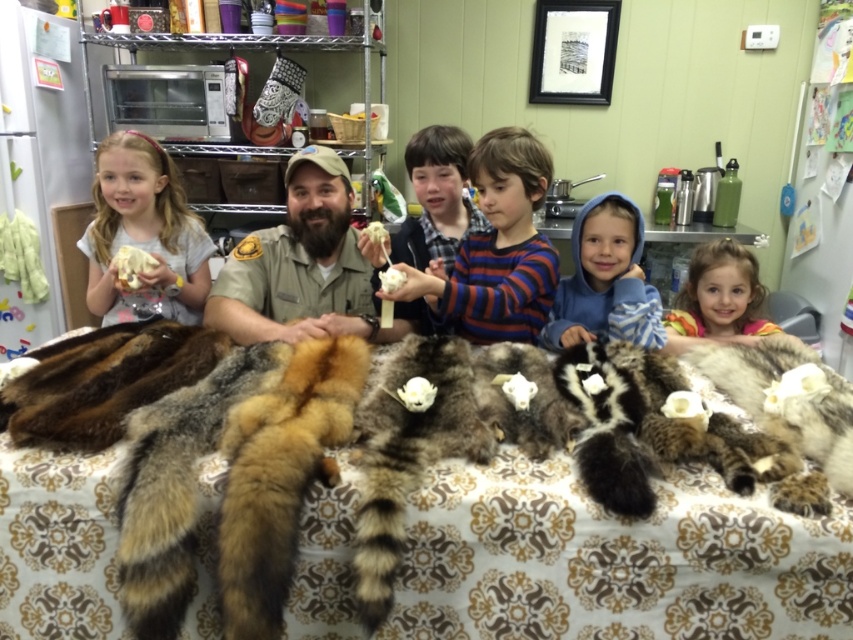
You are standing at the center of the scene and want to locate the blonde hair at lower right. Based on the coordinates provided, in which direction should you turn to face it?

The blonde hair at lower right is located at coordinates point (x=718, y=298), which means it is positioned to the lower right of the scene. Since you are at the center, you should turn to your lower right direction to face it.

You are a photographer trying to capture a group photo of the brown uniform at center and the white fluffy cotton at center. If you want to ensure both are fully visible in the frame, which object requires more space horizontally?

The brown uniform at center requires more horizontal space because its width is larger than the white fluffy cotton at center.

You are a photographer trying to capture a group photo of the brown uniform at center and the white fluffy cotton at center. Which object should you focus on first if you want to ensure both are in the frame?

The brown uniform at center is positioned on the left side of white fluffy cotton at center, so you should focus on the brown uniform at center first to ensure both are in the frame.